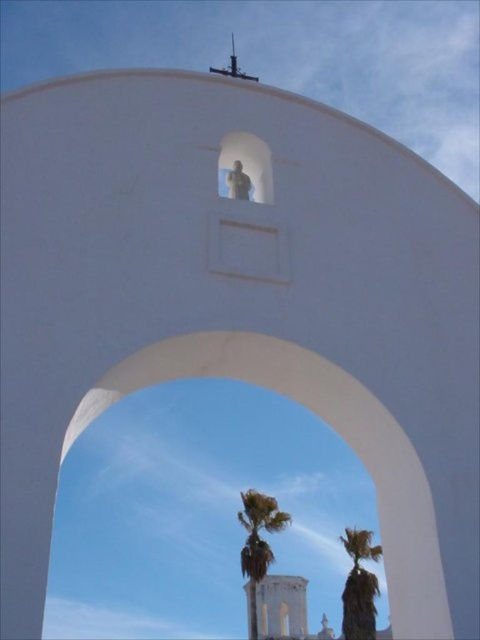
You are an architect designing a new garden space. You have two plants to place in front of an arched structure. The plants are the green leafy palm at center and the green leafy palm tree at center. Based on their widths, which plant should you choose if you want to ensure it doesn not block the view through the archway?

The green leafy palm at center is wider than the green leafy palm tree at center, so to avoid blocking the view through the archway, you should choose the green leafy palm tree at center since it is narrower.

You are an architect designing a new garden and want to place both the green leafy palm at center and the green leafy palm tree at center in your design. Which one should you choose if you want a larger plant?

The green leafy palm at center is bigger than the green leafy palm tree at center, so you should choose the green leafy palm at center for a larger plant.